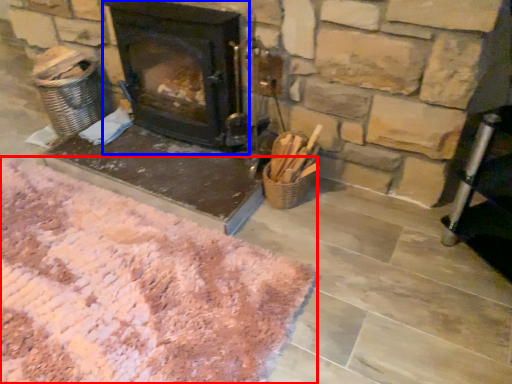
Question: Which object is closer to the camera taking this photo, mat (highlighted by a red box) or wood burning stove (highlighted by a blue box)?

Choices:
 (A) mat
 (B) wood burning stove

Answer: (A)